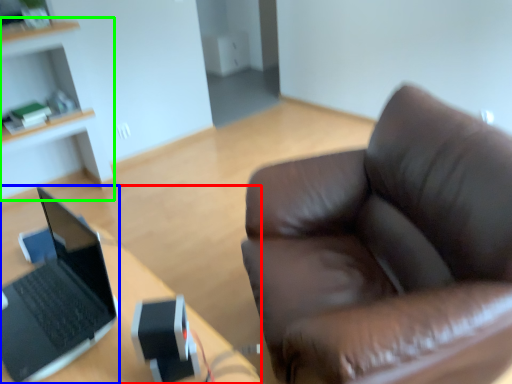
Question: Based on their relative distances, which object is farther from desk (highlighted by a red box)? Choose from laptop (highlighted by a blue box) and cabinetry (highlighted by a green box).

Choices:
 (A) laptop
 (B) cabinetry

Answer: (B)